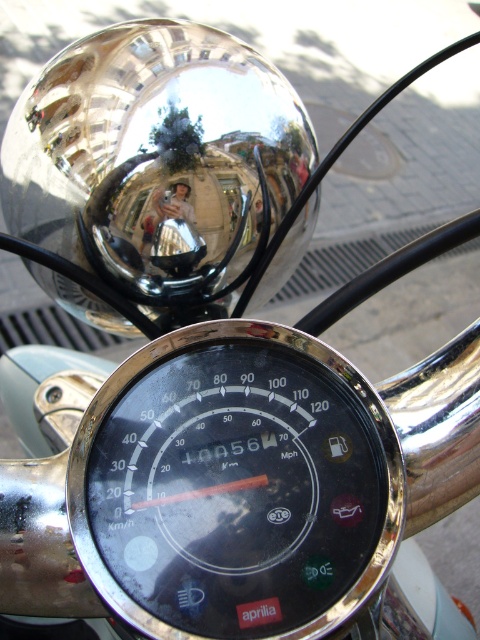
You are a rider checking your motorcycle dashboard. You notice the black glass speedometer at center and the polished chrome mirror at upper center. Which object is positioned higher on the dashboard?

The polished chrome mirror at upper center is positioned higher on the dashboard than the black glass speedometer at center.

You are a motorcycle rider checking your dashboard. You notice the black glass speedometer at center and the polished chrome mirror at upper center. Which object is narrower in width?

The black glass speedometer at center is thinner than the polished chrome mirror at upper center, so the black glass speedometer at center is narrower in width.